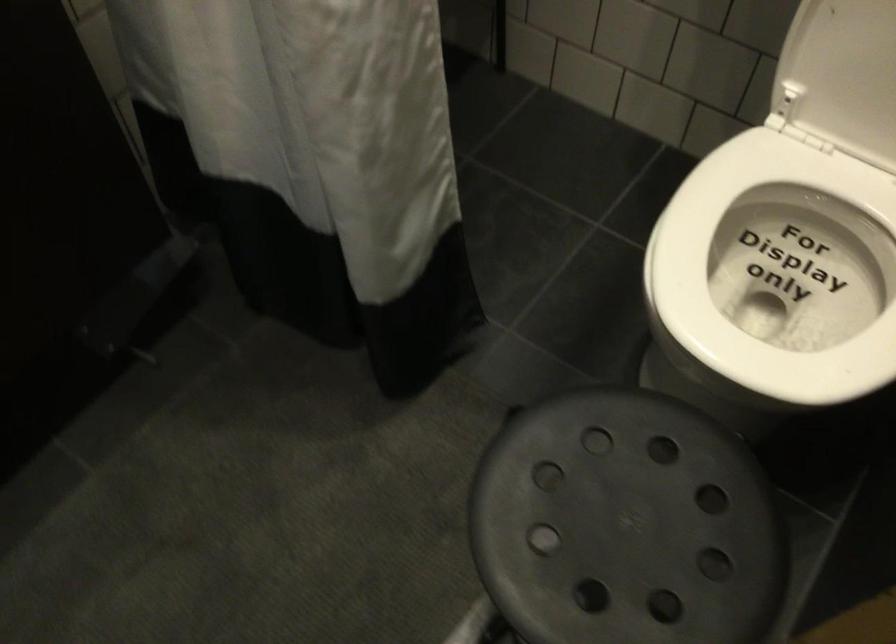
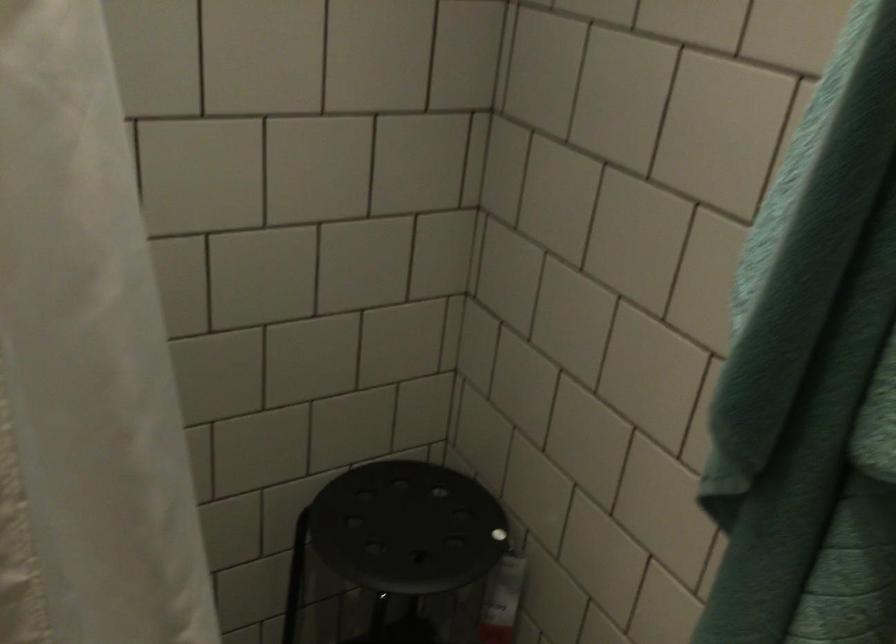
Based on the continuous images, in which direction is the camera rotating?

The camera rotated toward left-up.